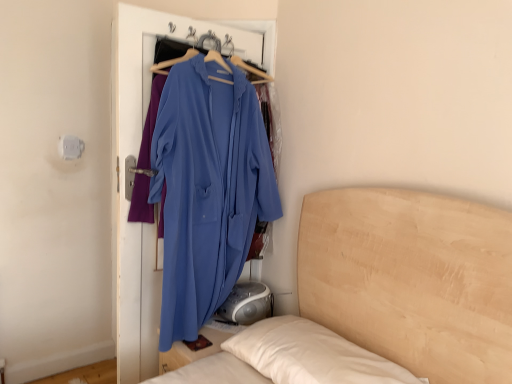
Question: In the image, is wooden bed at center on the left side or the right side of matte blue robe at center?

Choices:
 (A) right
 (B) left

Answer: (A)

Question: From the image's perspective, relative to matte blue robe at center, is wooden bed at center above or below?

Choices:
 (A) below
 (B) above

Answer: (A)

Question: Is point (397, 230) positioned closer to the camera than point (177, 163)?

Choices:
 (A) closer
 (B) farther

Answer: (A)

Question: In terms of width, does matte blue robe at center look wider or thinner when compared to wooden bed at center?

Choices:
 (A) wide
 (B) thin

Answer: (B)

Question: From a real-world perspective, relative to wooden bed at center, is matte blue robe at center vertically above or below?

Choices:
 (A) above
 (B) below

Answer: (A)

Question: Based on their positions, is matte blue robe at center located to the left or right of wooden bed at center?

Choices:
 (A) left
 (B) right

Answer: (A)

Question: In terms of size, does matte blue robe at center appear bigger or smaller than wooden bed at center?

Choices:
 (A) small
 (B) big

Answer: (A)